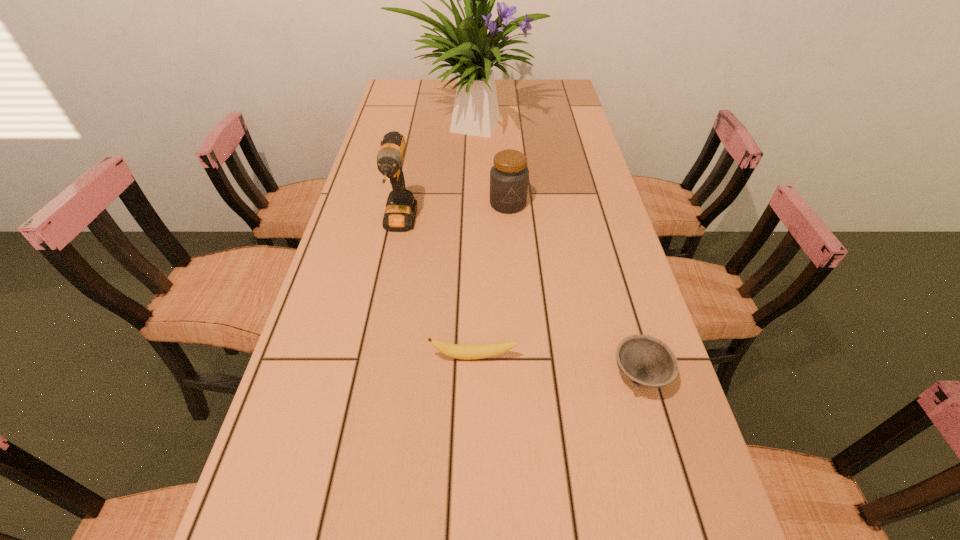
The width and height of the screenshot is (960, 540). I want to click on free spot between the third shortest object and the banana, so click(492, 280).

Identify the location of blank region between the bowl and the third shortest object. (574, 289).

Find the location of a particular element. object that is the third closest one to the banana is located at coordinates (509, 176).

Where is `object that is the closest to the drill`? object that is the closest to the drill is located at coordinates (509, 176).

Locate an element on the screen. This screenshot has width=960, height=540. free space in the image that satisfies the following two spatial constraints: 1. with the drill bit of the rightmost object facing forward; 2. on the right side of the fourth shortest object is located at coordinates (370, 375).

At what (x,y) coordinates should I click in order to perform the action: click on vacant region that satisfies the following two spatial constraints: 1. on the surface of the jar near the warning symbol; 2. on the right side of the rightmost object. Please return your answer as a coordinate pair (x, y). Looking at the image, I should click on (520, 375).

Where is `vacant space that satisfies the following two spatial constraints: 1. on the surface of the rightmost object near the warning symbol; 2. on the right side of the jar`? vacant space that satisfies the following two spatial constraints: 1. on the surface of the rightmost object near the warning symbol; 2. on the right side of the jar is located at coordinates (520, 375).